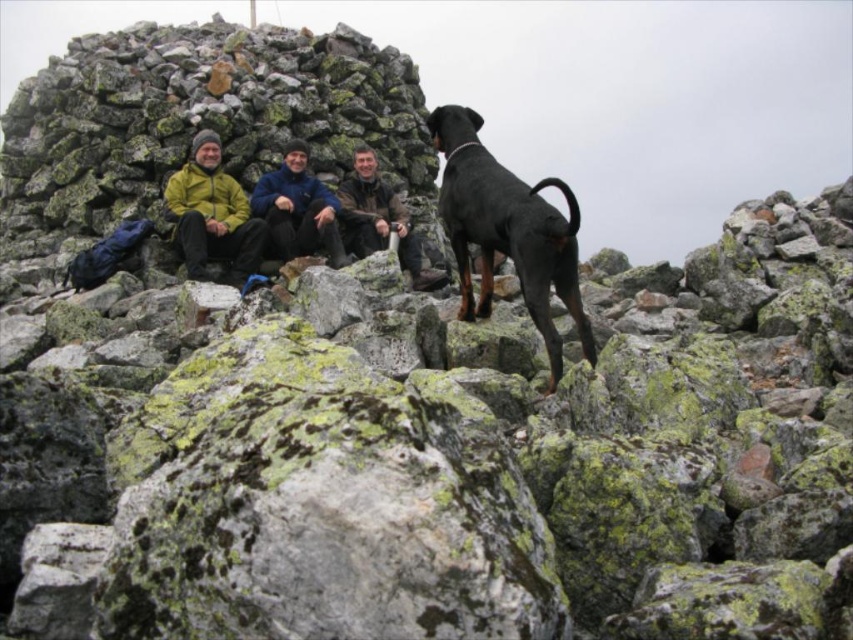
Is matte yellow jacket at center wider than dark brown leather jacket at center?

Incorrect, matte yellow jacket at center's width does not surpass dark brown leather jacket at center's.

Does matte yellow jacket at center have a lesser width compared to dark brown leather jacket at center?

Yes, matte yellow jacket at center is thinner than dark brown leather jacket at center.

Does point (241, 224) lie in front of point (357, 150)?

Yes, it is.

Image resolution: width=853 pixels, height=640 pixels. I want to click on matte yellow jacket at center, so click(x=212, y=214).

Where is `black smooth doberman at center`? The image size is (853, 640). black smooth doberman at center is located at coordinates (508, 230).

Is black smooth doberman at center above matte yellow jacket at center?

No, black smooth doberman at center is not above matte yellow jacket at center.

Which is in front, point (527, 269) or point (257, 241)?

Point (527, 269) is in front.

In order to click on black smooth doberman at center in this screenshot , I will do `click(508, 230)`.

Who is taller, black smooth doberman at center or blue fleece jacket at center?

Standing taller between the two is black smooth doberman at center.

Does black smooth doberman at center have a greater height compared to blue fleece jacket at center?

Correct, black smooth doberman at center is much taller as blue fleece jacket at center.

Locate an element on the screen. black smooth doberman at center is located at coordinates [x=508, y=230].